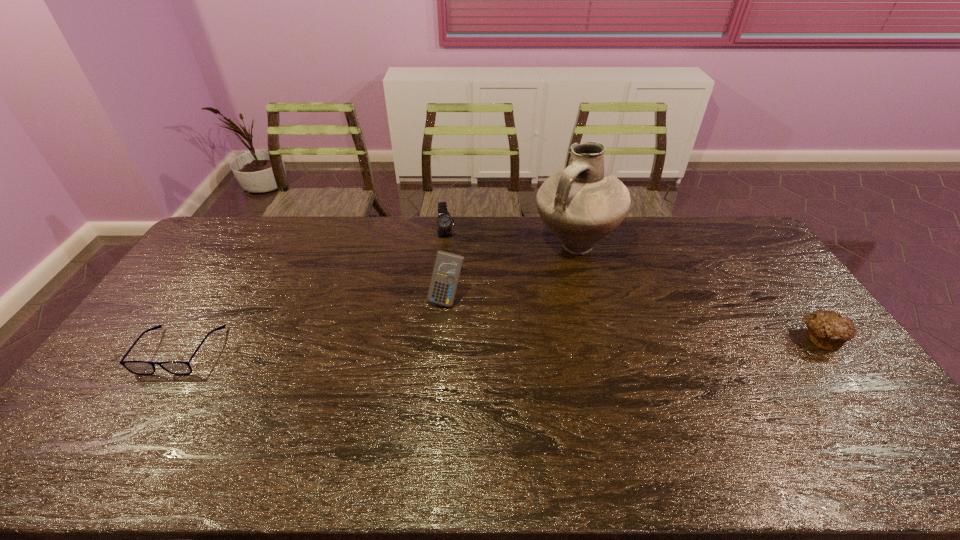
Where is `pitcher that is positioned at the far edge`? pitcher that is positioned at the far edge is located at coordinates pos(581,204).

Find the location of a particular element. The height and width of the screenshot is (540, 960). watch that is at the far edge is located at coordinates (445, 221).

Where is `object that is positioned at the left edge`? The width and height of the screenshot is (960, 540). object that is positioned at the left edge is located at coordinates (136, 367).

In order to click on object at the right edge in this screenshot , I will do `click(828, 330)`.

You are a GUI agent. You are given a task and a screenshot of the screen. Output one action in this format:
    pyautogui.click(x=<x>, y=<y>)
    Task: Click on the vacant space at the far edge
    
    Given the screenshot: What is the action you would take?
    pyautogui.click(x=358, y=237)

The image size is (960, 540). Identify the location of vacant point at the near edge. (348, 404).

What are the coordinates of `free space at the right edge of the desktop` in the screenshot? It's located at (756, 266).

Find the location of a particular element. The height and width of the screenshot is (540, 960). vacant space at the far left corner is located at coordinates (222, 230).

This screenshot has height=540, width=960. I want to click on blank space at the near left corner of the desktop, so click(x=117, y=424).

You are a GUI agent. You are given a task and a screenshot of the screen. Output one action in this format:
    pyautogui.click(x=<x>, y=<y>)
    Task: Click on the vacant space at the near right corner of the desktop
    
    Given the screenshot: What is the action you would take?
    pyautogui.click(x=849, y=413)